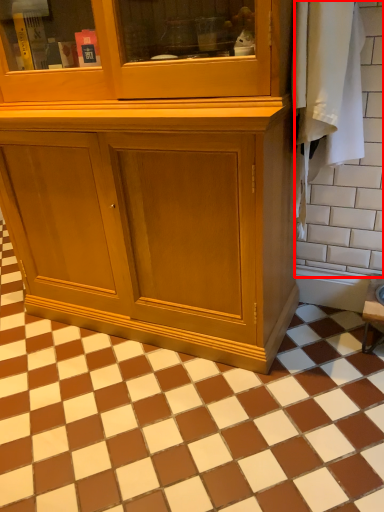
Question: From the image's perspective, what is the correct spatial positioning of ceramic tile (annotated by the red box) in reference to ceramic tile?

Choices:
 (A) below
 (B) above

Answer: (B)